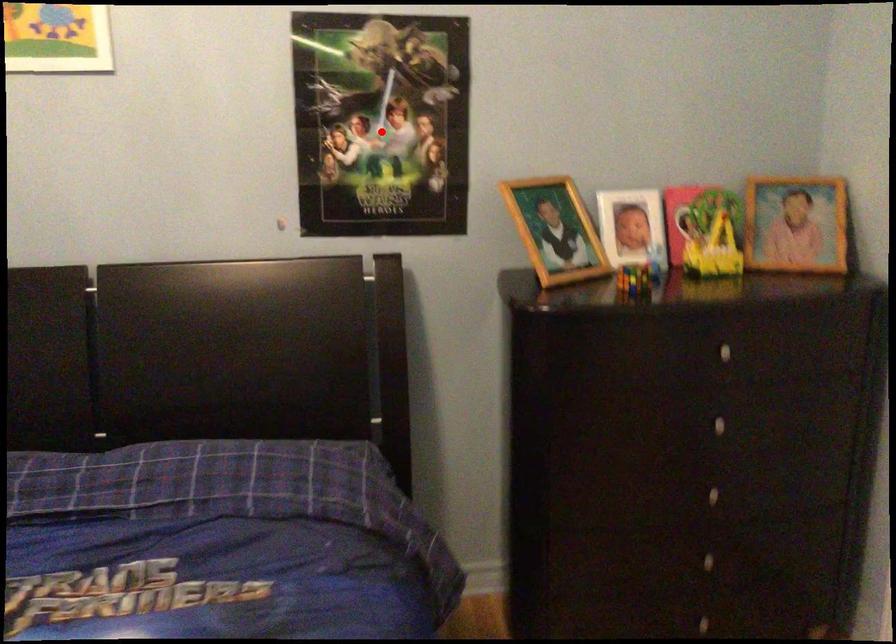
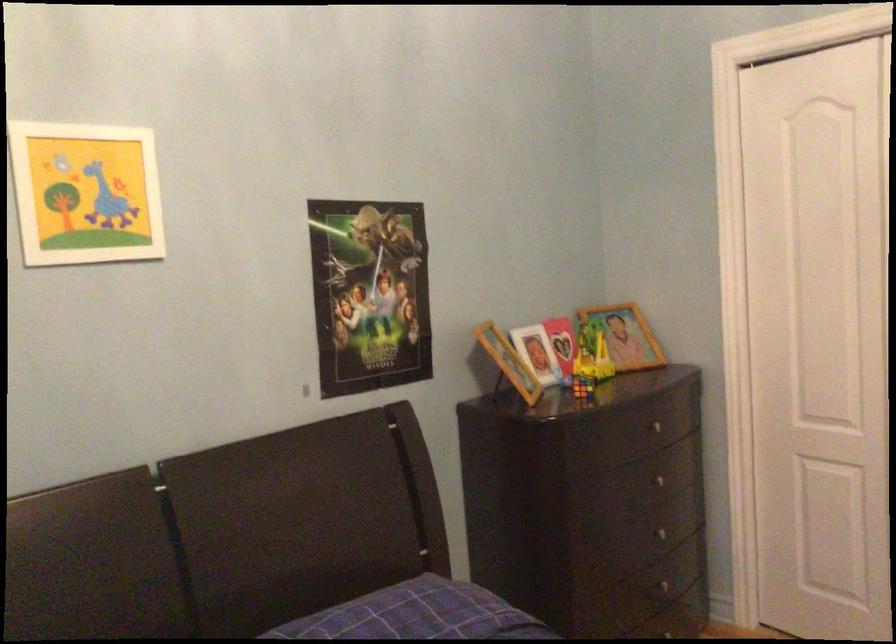
Question: I am providing you with two images of the same scene from different viewpoints. A red point is marked on the first image. At the location where the point appears in image 1, is it still visible in image 2?

Choices:
 (A) Yes
 (B) No

Answer: (A)